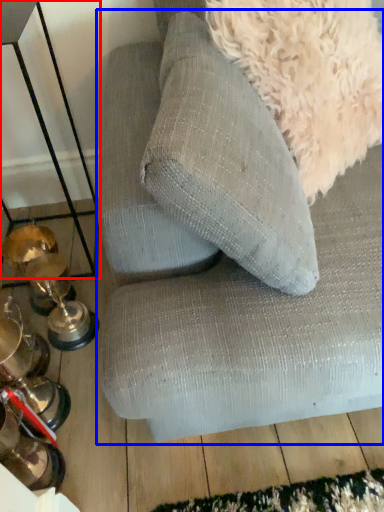
Question: Which object is closer to the camera taking this photo, table (highlighted by a red box) or studio couch (highlighted by a blue box)?

Choices:
 (A) table
 (B) studio couch

Answer: (B)